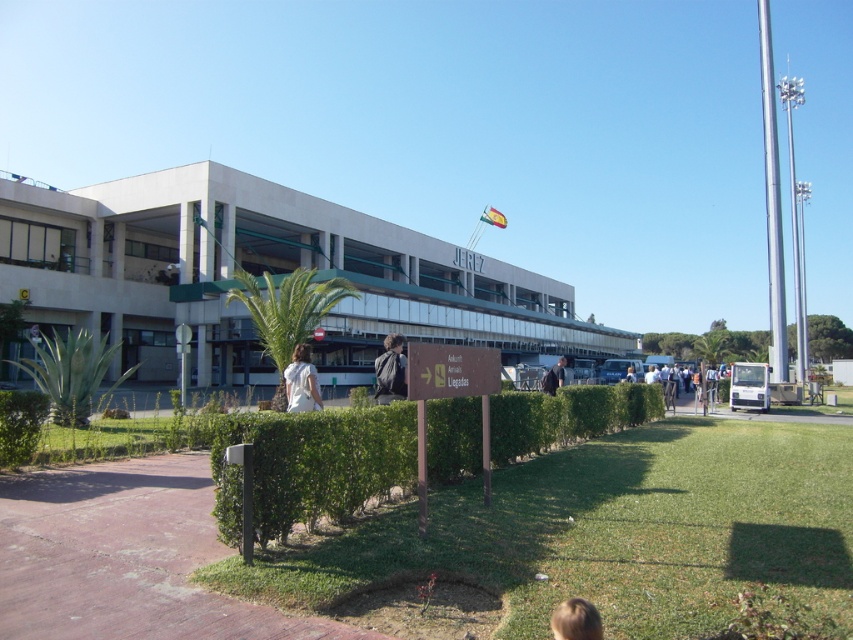
Question: Can you confirm if green grass at lower center is wider than white fabric shirt at lower center?

Choices:
 (A) yes
 (B) no

Answer: (A)

Question: Among these objects, which one is farthest from the camera?

Choices:
 (A) blonde hair at lower right
 (B) green leafy hedge at center

Answer: (B)

Question: Does white fabric shirt at lower center have a smaller size compared to dark blue jeans at center?

Choices:
 (A) no
 (B) yes

Answer: (B)

Question: Which point is farther to the camera?

Choices:
 (A) (302, 358)
 (B) (398, 396)
 (C) (561, 358)

Answer: (C)

Question: Does matte black backpack at center have a greater width compared to dark blue jeans at center?

Choices:
 (A) no
 (B) yes

Answer: (A)

Question: Which of these objects is positioned closest to the dark blue jeans at center?

Choices:
 (A) white fabric shirt at lower center
 (B) matte black backpack at center
 (C) green grass at lower center

Answer: (C)